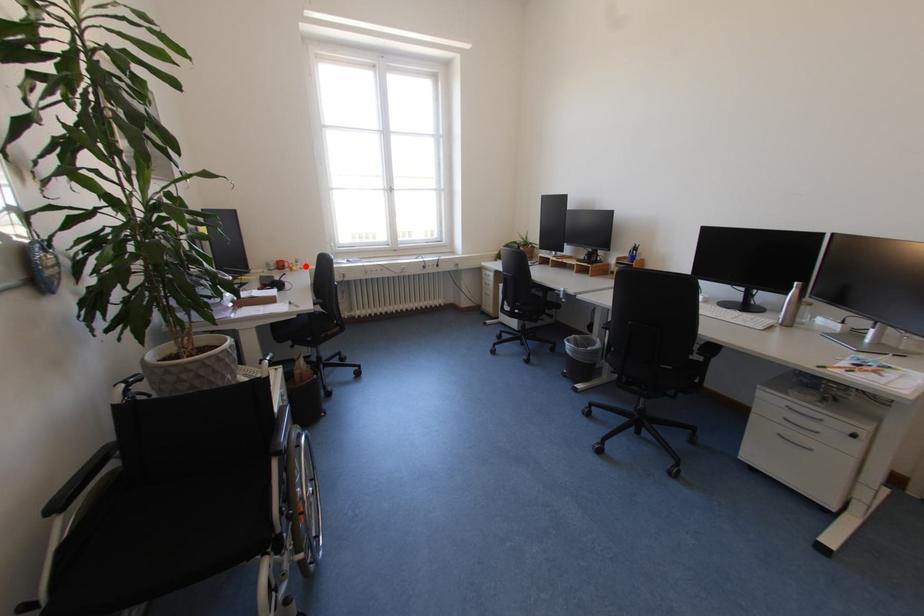
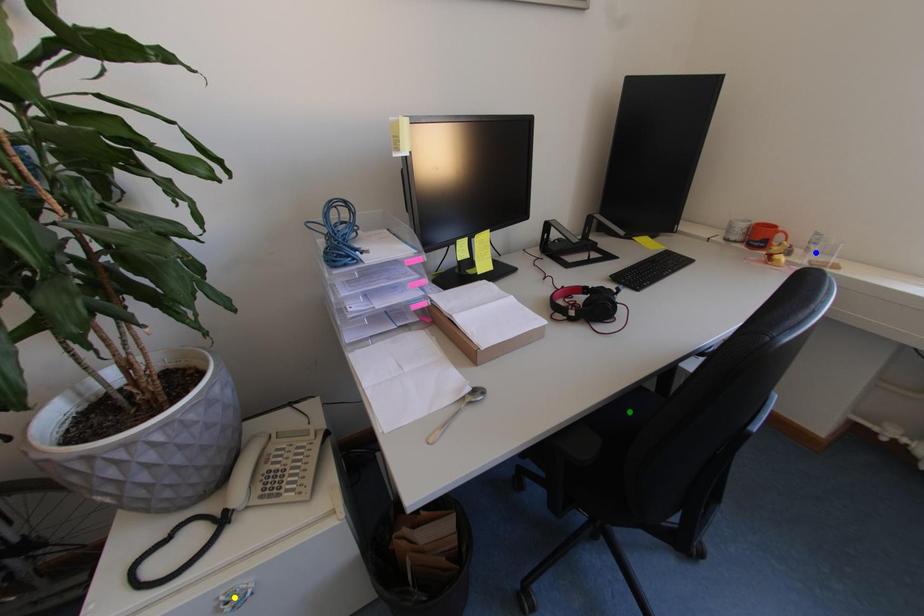
Question: I am providing you with two images of the same scene from different viewpoints. A red point is marked on the first image. You are given multiple points on the second image. In image 2, which mark is for the same physical point as the one in image 1?

Choices:
 (A) yellow point
 (B) blue point
 (C) green point

Answer: (B)